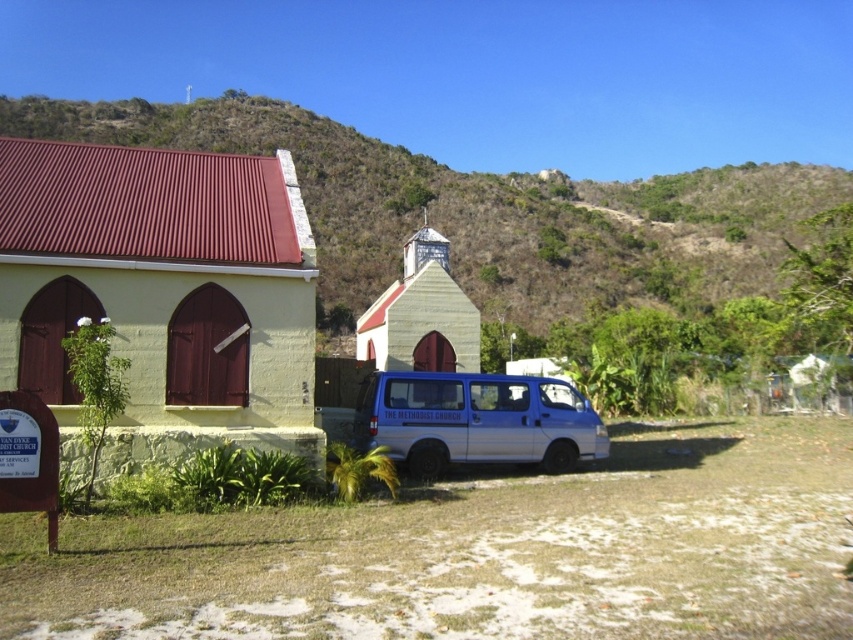
Question: Observing the image, what is the correct spatial positioning of yellow matte church at center in reference to green grassy hillside at upper center?

Choices:
 (A) above
 (B) below

Answer: (B)

Question: Which of these objects is positioned farthest from the wooden chapel at center?

Choices:
 (A) green grassy hillside at upper center
 (B) yellow matte church at center
 (C) blue metallic van at center

Answer: (A)

Question: Can you confirm if green grassy hillside at upper center is thinner than wooden chapel at center?

Choices:
 (A) yes
 (B) no

Answer: (B)

Question: Based on their relative distances, which object is farther from the wooden chapel at center?

Choices:
 (A) green grassy hillside at upper center
 (B) yellow matte church at center

Answer: (A)

Question: Which object appears closest to the camera in this image?

Choices:
 (A) blue metallic van at center
 (B) wooden chapel at center
 (C) green grassy hillside at upper center
 (D) yellow matte church at center

Answer: (D)

Question: Is yellow matte church at center bigger than wooden chapel at center?

Choices:
 (A) no
 (B) yes

Answer: (A)